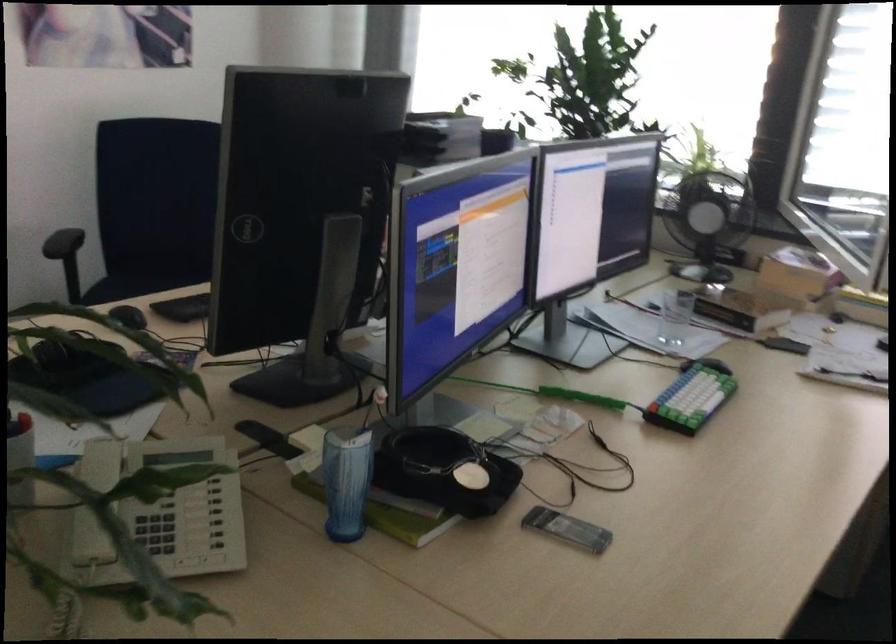
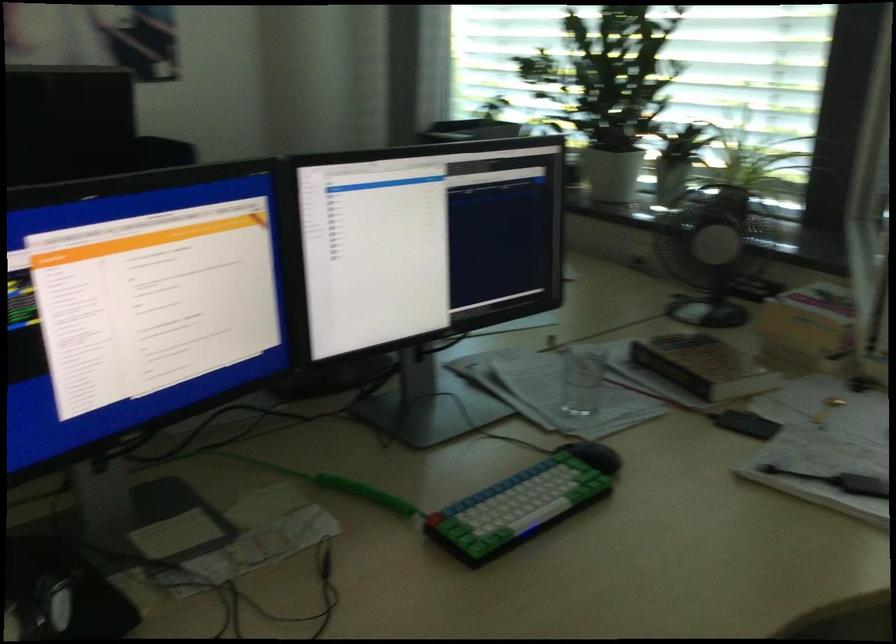
Where in the second image is the point corresponding to [718,222] from the first image?

(711, 252)